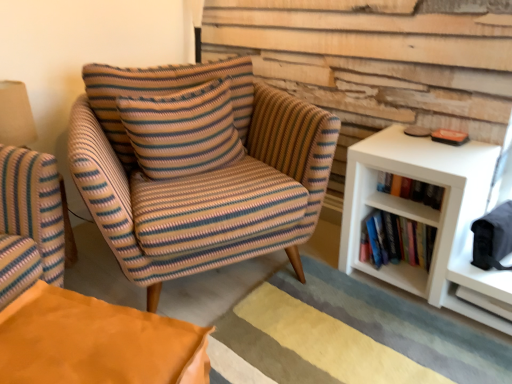
Question: Does hardcover books at right appear on the left side of white matte bookshelf at right, the second shelf when ordered from right to left?

Choices:
 (A) yes
 (B) no

Answer: (B)

Question: Is hardcover books at right with white matte bookshelf at right, arranged as the 1th shelf when viewed from the left?

Choices:
 (A) no
 (B) yes

Answer: (A)

Question: Is hardcover books at right oriented away from white matte bookshelf at right, arranged as the 1th shelf when viewed from the left?

Choices:
 (A) yes
 (B) no

Answer: (B)

Question: Is hardcover books at right completely or partially outside of white matte bookshelf at right, arranged as the 1th shelf when viewed from the left?

Choices:
 (A) yes
 (B) no

Answer: (A)

Question: Is hardcover books at right positioned far away from white matte bookshelf at right, the second shelf when ordered from right to left?

Choices:
 (A) no
 (B) yes

Answer: (A)

Question: In terms of height, does white matte shelf at right, which is counted as the first shelf, starting from the right, look taller or shorter compared to striped fabric armchair at center?

Choices:
 (A) tall
 (B) short

Answer: (B)

Question: Considering the positions of white matte shelf at right, which is counted as the first shelf, starting from the right, and striped fabric armchair at center in the image, is white matte shelf at right, which is counted as the first shelf, starting from the right, wider or thinner than striped fabric armchair at center?

Choices:
 (A) wide
 (B) thin

Answer: (B)

Question: From the image's perspective, is white matte shelf at right, which is counted as the first shelf, starting from the right, above or below striped fabric armchair at center?

Choices:
 (A) above
 (B) below

Answer: (B)

Question: Is white matte shelf at right, which is counted as the first shelf, starting from the right, to the left or to the right of striped fabric armchair at center in the image?

Choices:
 (A) right
 (B) left

Answer: (A)

Question: From the image's perspective, is knitted fabric pillow at center positioned above or below striped fabric armchair at center?

Choices:
 (A) above
 (B) below

Answer: (A)

Question: Is knitted fabric pillow at center to the left or to the right of striped fabric armchair at center in the image?

Choices:
 (A) right
 (B) left

Answer: (B)

Question: Considering the positions of knitted fabric pillow at center and striped fabric armchair at center in the image, is knitted fabric pillow at center bigger or smaller than striped fabric armchair at center?

Choices:
 (A) small
 (B) big

Answer: (A)

Question: Is point (230, 91) closer or farther from the camera than point (228, 213)?

Choices:
 (A) farther
 (B) closer

Answer: (A)

Question: Is hardcover books at right in front of or behind striped fabric armchair at center in the image?

Choices:
 (A) front
 (B) behind

Answer: (B)

Question: From a real-world perspective, is hardcover books at right positioned above or below striped fabric armchair at center?

Choices:
 (A) below
 (B) above

Answer: (A)